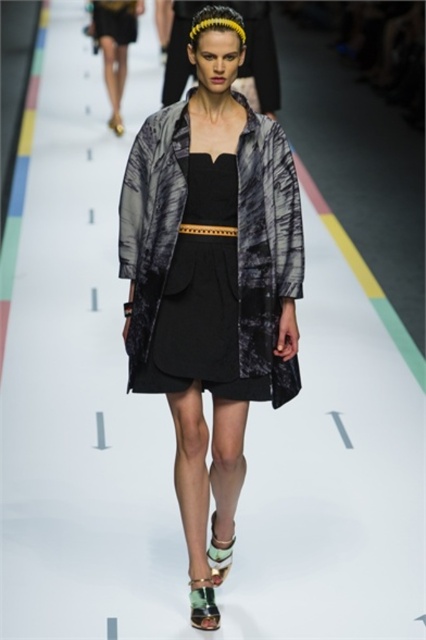
Question: Considering the real-world distances, which object is closest to the matte black shorts at upper left?

Choices:
 (A) black matte dress at upper center
 (B) leather textured sandal at lower center

Answer: (A)

Question: Is matte black shorts at upper left positioned at the back of shiny metallic sandal at lower center?

Choices:
 (A) yes
 (B) no

Answer: (A)

Question: Which object is closer to the camera taking this photo?

Choices:
 (A) matte black shorts at upper left
 (B) black matte dress at upper center

Answer: (A)

Question: Which object is positioned closest to the black leather belt at center?

Choices:
 (A) black matte dress at upper center
 (B) shiny metallic sandal at lower center
 (C) leather textured sandal at lower center

Answer: (C)

Question: Does shiny metallic sandal at lower center have a greater width compared to black leather belt at center?

Choices:
 (A) yes
 (B) no

Answer: (B)

Question: Is black leather belt at center positioned behind green suede sandal at center?

Choices:
 (A) no
 (B) yes

Answer: (A)